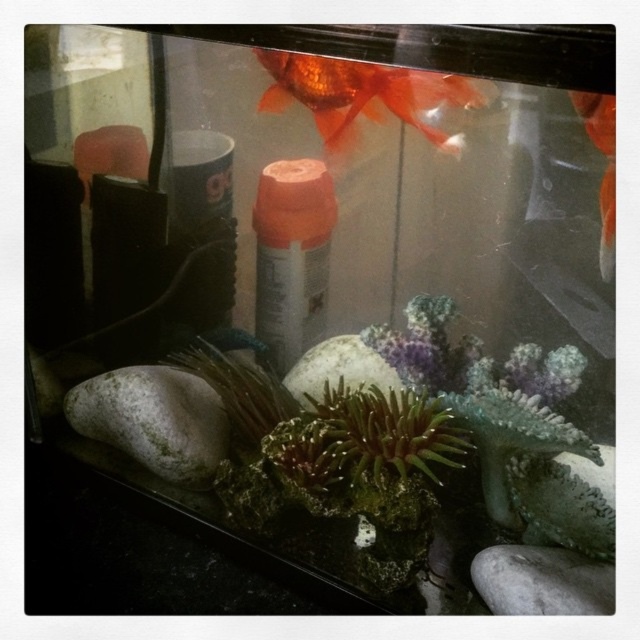
You are an observer looking into the fish tank. You see a shiny orange fish at upper center and an orange glossy goldfish at upper right. Which of these two fish is positioned more to the right side of the tank?

The orange glossy goldfish at upper right is positioned more to the right side of the tank compared to the shiny orange fish at upper center, which is located to its left.